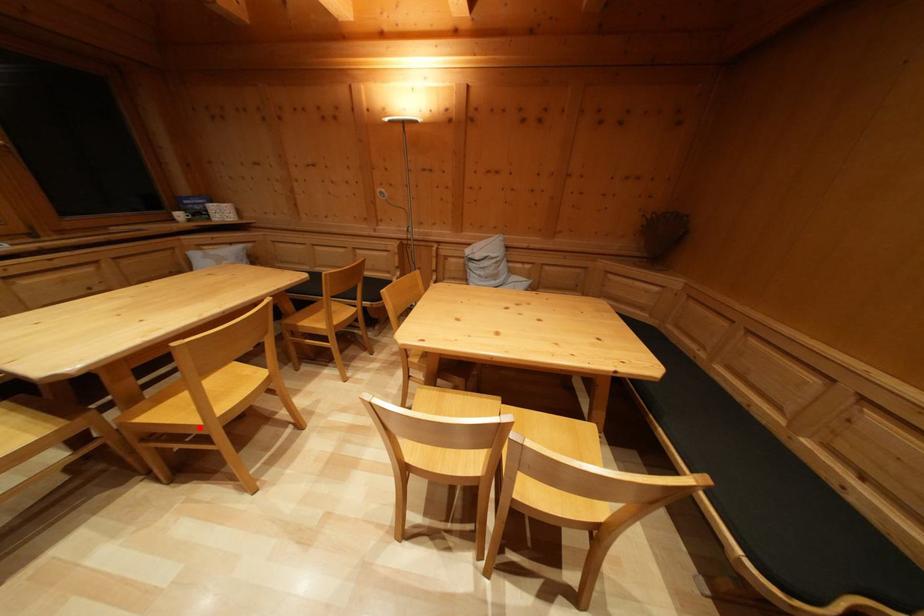
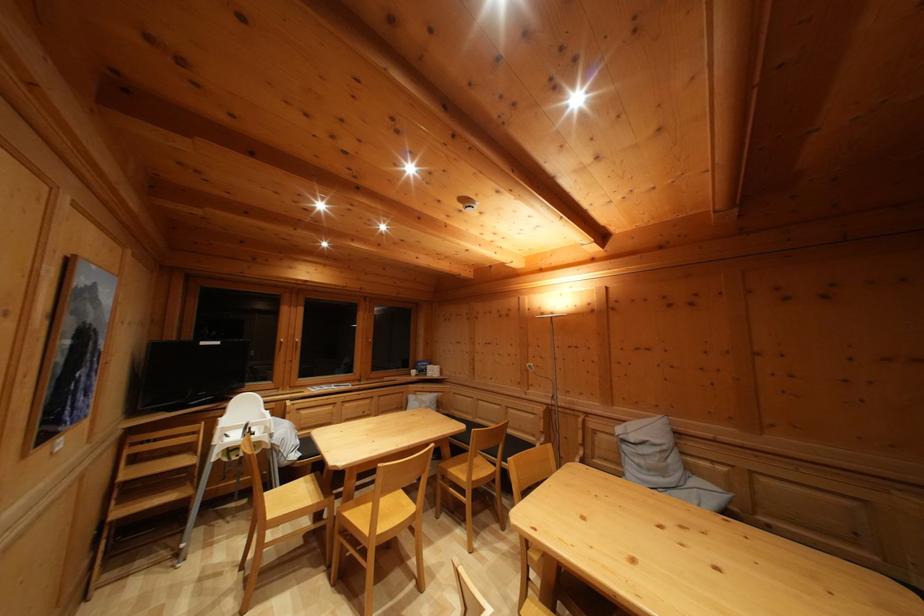
Question: I am providing you with two images of the same scene from different viewpoints. Given a red point in image1, look at the same physical point in image2. Is it:

Choices:
 (A) Closer to the viewpoint
 (B) Farther from the viewpoint

Answer: (B)